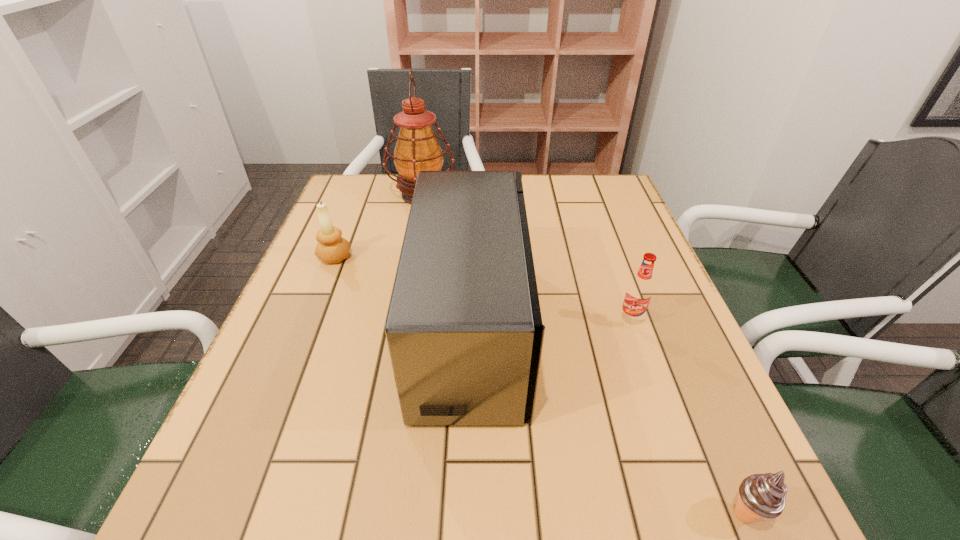
This screenshot has height=540, width=960. I want to click on vacant region located 0.280m on the back of the leftmost object, so click(x=362, y=190).

This screenshot has height=540, width=960. What are the coordinates of `vacant point located on the back of the shortest object` in the screenshot? It's located at (709, 433).

Identify the location of object that is at the far edge. The width and height of the screenshot is (960, 540). (417, 149).

I want to click on object present at the near edge, so click(x=760, y=495).

Where is `oil lamp at the left edge`? The width and height of the screenshot is (960, 540). oil lamp at the left edge is located at coordinates point(417,149).

This screenshot has height=540, width=960. In order to click on candle_holder present at the left edge in this screenshot , I will do `click(331, 248)`.

Identify the location of root beer located in the right edge section of the desktop. Image resolution: width=960 pixels, height=540 pixels. (639, 291).

Locate an element on the screen. The width and height of the screenshot is (960, 540). icecream that is at the right edge is located at coordinates (760, 495).

Where is `object located at the far left corner`? The width and height of the screenshot is (960, 540). object located at the far left corner is located at coordinates (417, 149).

Find the location of a particular element. object located in the near right corner section of the desktop is located at coordinates (760, 495).